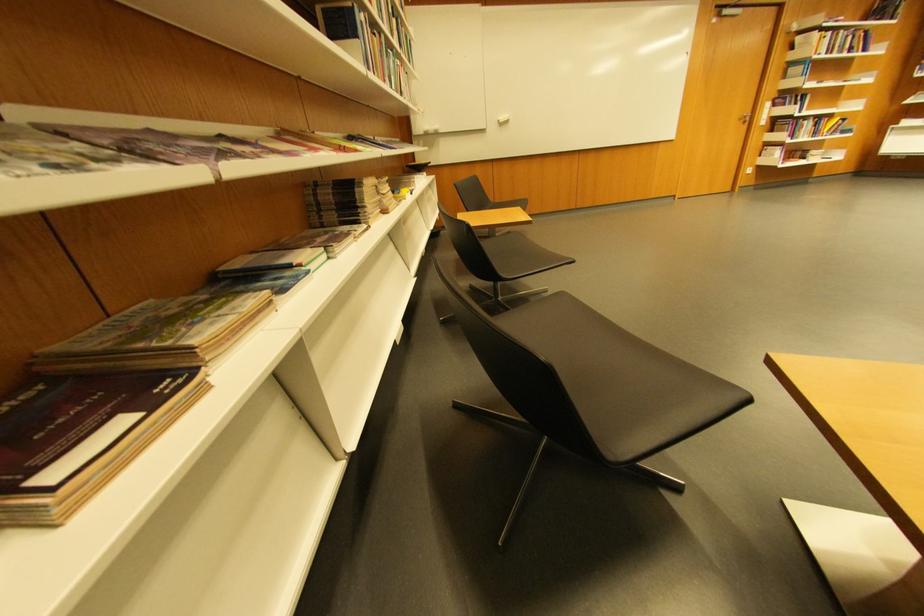
Where would you pull the silver door handle? Please return your answer as a coordinate pair (x, y).

(745, 118)